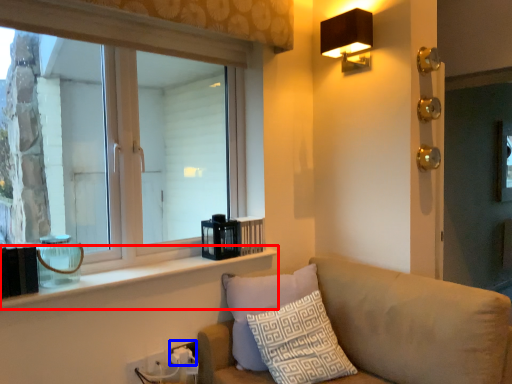
Question: Which point is further to the camera, window sill (highlighted by a red box) or electric outlet (highlighted by a blue box)?

Choices:
 (A) window sill
 (B) electric outlet

Answer: (B)